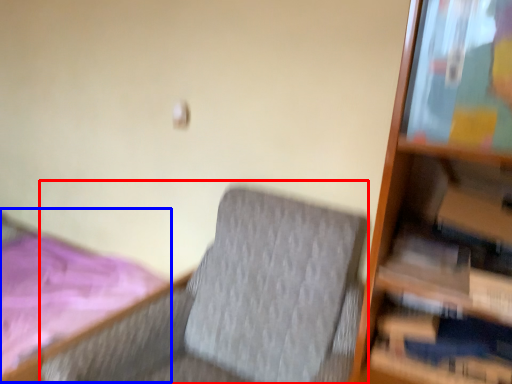
Question: Which of the following is the closest to the observer, rocking chair (highlighted by a red box) or bed (highlighted by a blue box)?

Choices:
 (A) rocking chair
 (B) bed

Answer: (A)